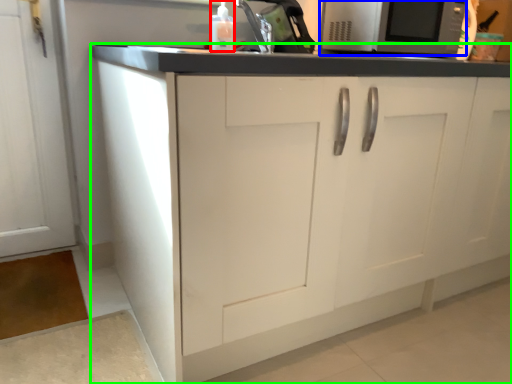
Question: Based on their relative distances, which object is farther from bottle (highlighted by a red box)? Choose from microwave oven (highlighted by a blue box) and cabinetry (highlighted by a green box).

Choices:
 (A) microwave oven
 (B) cabinetry

Answer: (B)